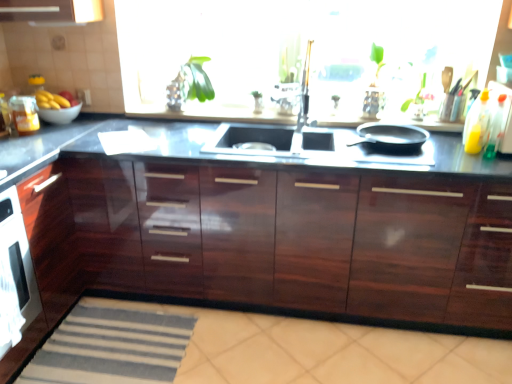
Question: Based on their positions, is transparent glass window at center located to the left or right of black matte frying pan at right?

Choices:
 (A) left
 (B) right

Answer: (A)

Question: From their relative heights in the image, would you say transparent glass window at center is taller or shorter than black matte frying pan at right?

Choices:
 (A) tall
 (B) short

Answer: (A)

Question: Estimate the real-world distances between objects in this image. Which object is farther from the transparent glass window at center?

Choices:
 (A) translucent plastic bottle at right, which is counted as the 1th bottle, starting from the front
 (B) white glossy bowl at upper left
 (C) yellow matte bananas at left
 (D) glossy black countertop at center
 (E) translucent plastic bottle at right, the first bottle when ordered from back to front

Answer: (C)

Question: Estimate the real-world distances between objects in this image. Which object is closer to the black matte frying pan at right?

Choices:
 (A) yellow matte bananas at left
 (B) glossy black countertop at center
 (C) translucent plastic bottle at right, positioned as the second bottle in front-to-back order
 (D) translucent plastic bottle at right, which is counted as the 1th bottle, starting from the front
 (E) transparent glass window at center

Answer: (C)